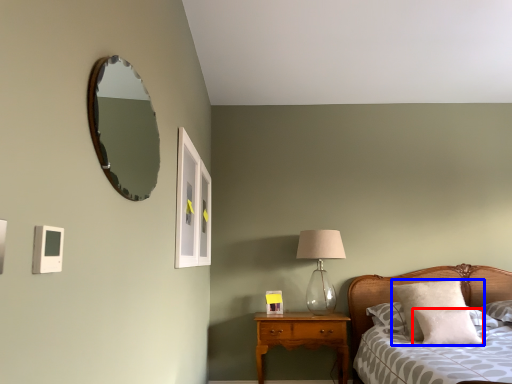
Question: Which of the following is the closest to the observer, pillow (highlighted by a red box) or pillow (highlighted by a blue box)?

Choices:
 (A) pillow
 (B) pillow

Answer: (A)